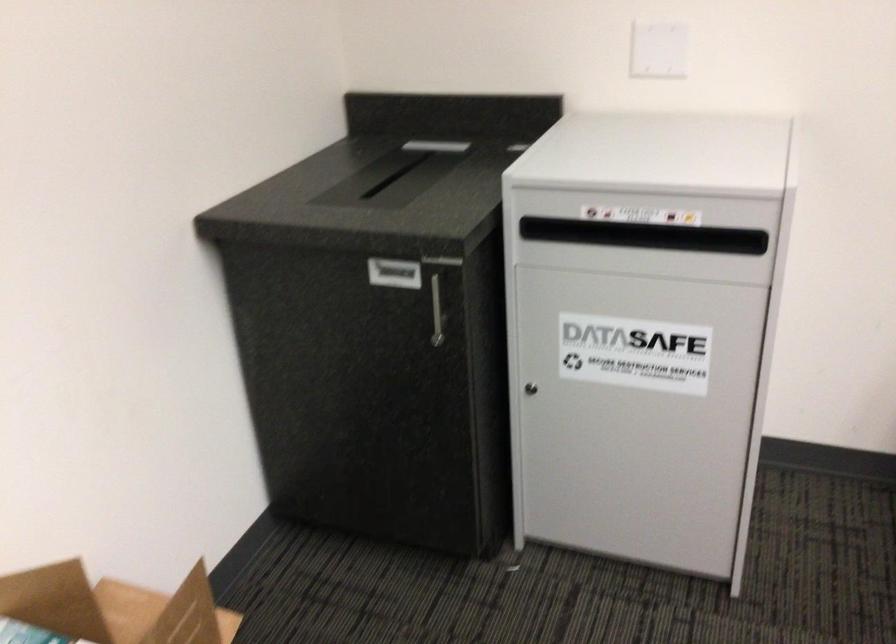
What do you see at coordinates (746, 241) in the screenshot? I see `the grey bin slot` at bounding box center [746, 241].